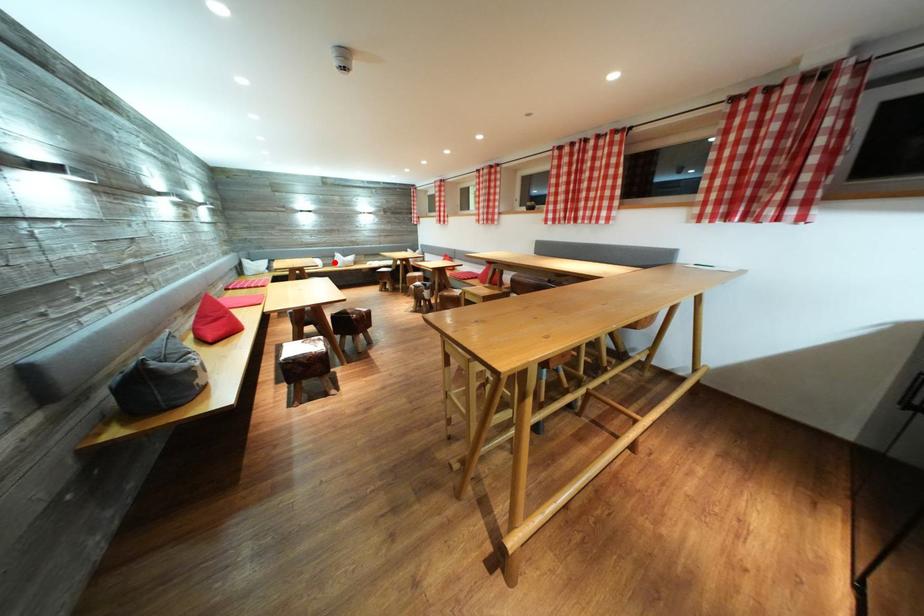
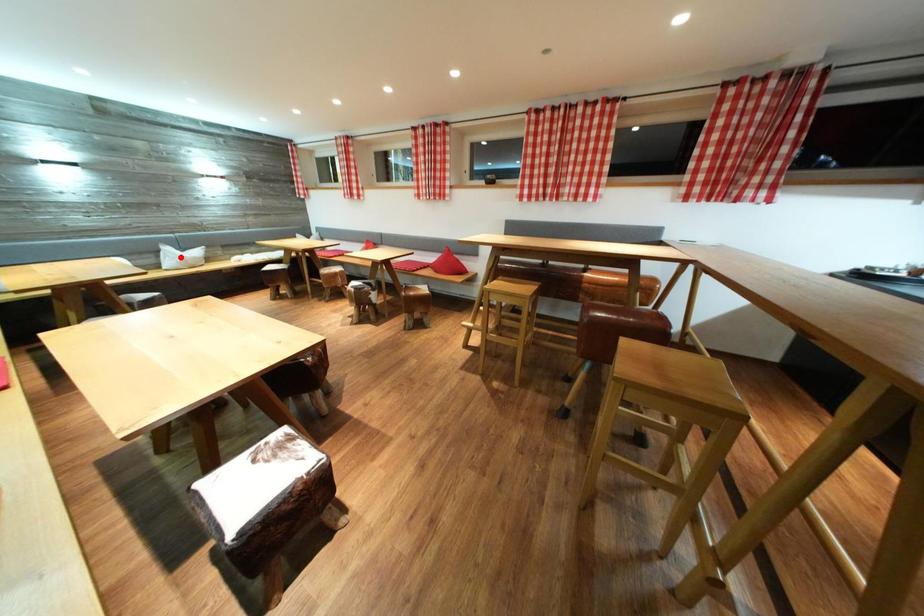
I am providing you with two images of the same scene from different viewpoints. A red point is marked on the first image and another point is marked on the second image. Do the highlighted points in image1 and image2 indicate the same real-world spot?

No